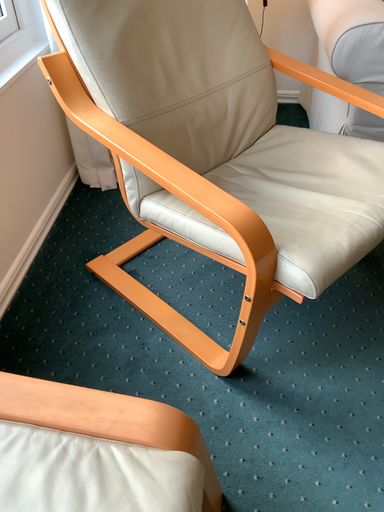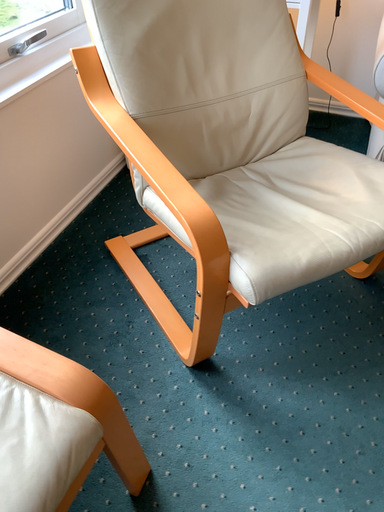
Question: How did the camera likely rotate when shooting the video?

Choices:
 (A) rotated right
 (B) rotated left

Answer: (B)